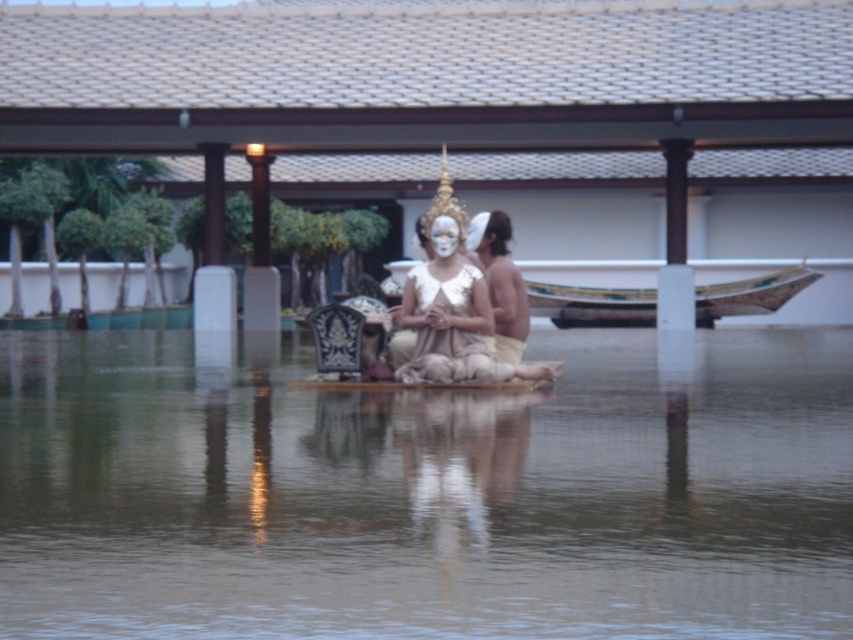
Question: Can you confirm if brown matte wood at center is wider than white matte face at center?

Choices:
 (A) no
 (B) yes

Answer: (B)

Question: Does brown matte wood at center come behind white matte face at center?

Choices:
 (A) no
 (B) yes

Answer: (A)

Question: Which point is farther to the camera?

Choices:
 (A) white matte face at center
 (B) brown matte wood at center

Answer: (A)

Question: Which point is closer to the camera taking this photo?

Choices:
 (A) (451, 227)
 (B) (236, 488)

Answer: (B)

Question: Is brown matte wood at center to the left of white matte face at center from the viewer's perspective?

Choices:
 (A) yes
 (B) no

Answer: (A)

Question: Which point is farther from the camera taking this photo?

Choices:
 (A) (206, 403)
 (B) (454, 234)

Answer: (B)